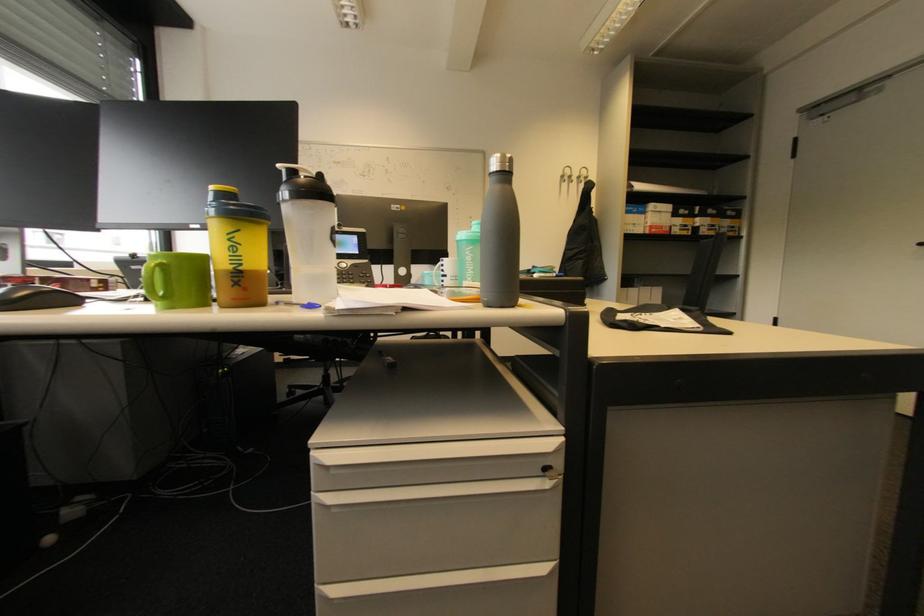
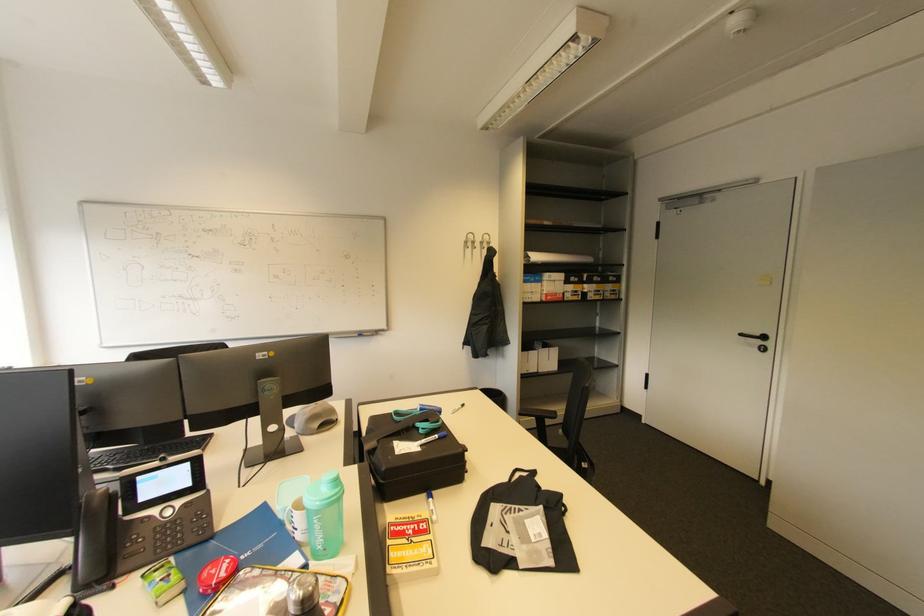
Find the pixel in the second image that matches (x=584, y=177) in the first image.

(487, 244)